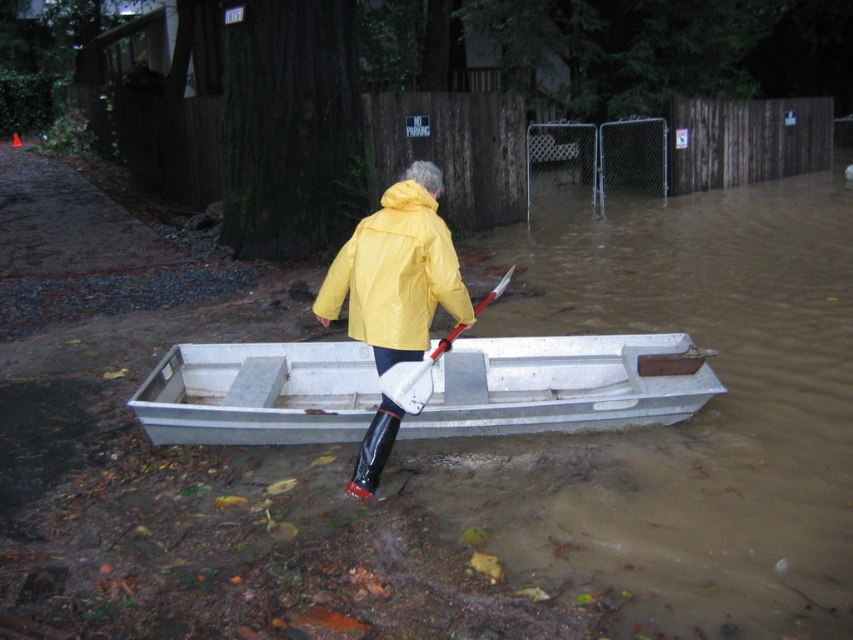
You are a photographer trying to capture the person in the yellow matte jacket at center and the white plastic paddle at center. Which object is wider?

The yellow matte jacket at center is wider than the white plastic paddle at center.

You are a rescue worker in a flooded area. You need to reach the house behind the fence. The metallic gray boat at center is your only means of transportation. Considering the distance between you and the boat, can you safely walk to the boat without wading through deeper water?

The metallic gray boat at center is 4.39 meters away from your position. Since the water depth is shallow enough for you to walk to it, you can safely reach the boat without wading through deeper water.